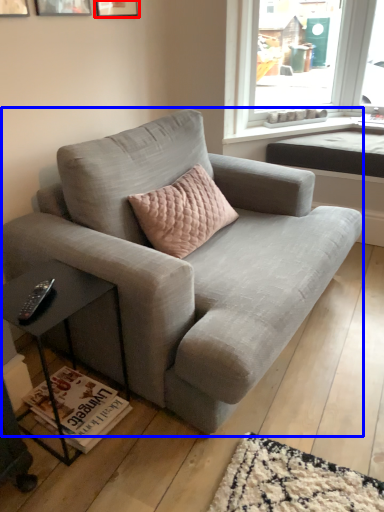
Question: Which point is closer to the camera, picture frame (highlighted by a red box) or studio couch (highlighted by a blue box)?

Choices:
 (A) picture frame
 (B) studio couch

Answer: (B)